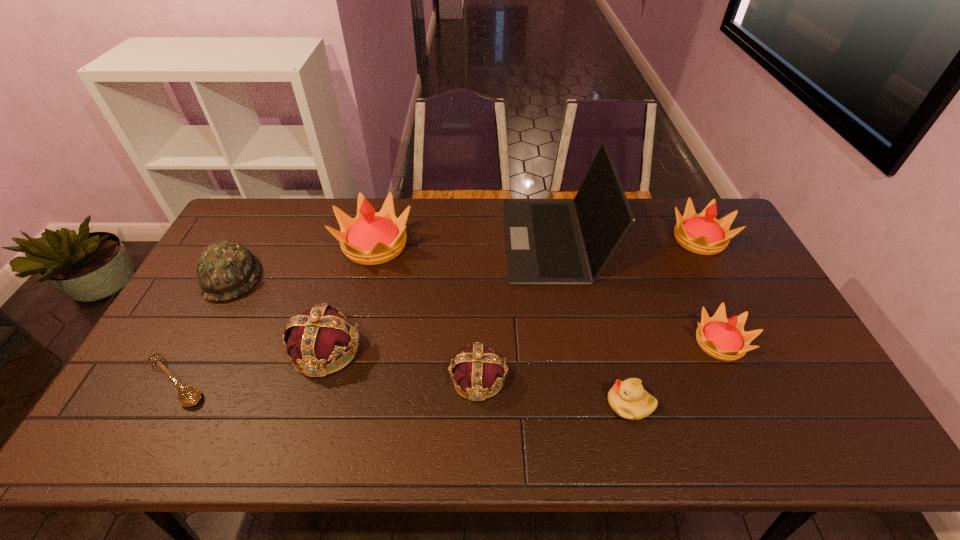
Where is `object that can be found as the closest to the tallest object`? Image resolution: width=960 pixels, height=540 pixels. object that can be found as the closest to the tallest object is located at coordinates (724, 339).

Find the location of a particular element. This screenshot has height=540, width=960. the seventh closest object to the left purple crown is located at coordinates (724, 339).

Locate an element on the screen. crown that is the fourth closest to the smaller purple crown is located at coordinates (702, 233).

This screenshot has height=540, width=960. Find the location of `the third closest crown relative to the headwear`. the third closest crown relative to the headwear is located at coordinates (477, 372).

Point out which yellow crown is positioned as the third nearest to the yellow duckling. Please provide its 2D coordinates. Your answer should be formatted as a tuple, i.e. [(x, y)], where the tuple contains the x and y coordinates of a point satisfying the conditions above.

[(371, 238)]

Point out which yellow crown is positioned as the nearest to the headwear. Please provide its 2D coordinates. Your answer should be formatted as a tuple, i.e. [(x, y)], where the tuple contains the x and y coordinates of a point satisfying the conditions above.

[(371, 238)]

This screenshot has height=540, width=960. Find the location of `vacant position in the image that satisfies the following two spatial constraints: 1. on the screen of the laptop; 2. on the back side of the nearest yellow crown`. vacant position in the image that satisfies the following two spatial constraints: 1. on the screen of the laptop; 2. on the back side of the nearest yellow crown is located at coordinates (572, 342).